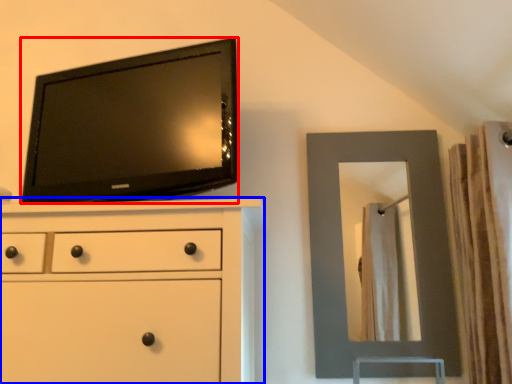
Question: Which object is further to the camera taking this photo, television (highlighted by a red box) or chest of drawers (highlighted by a blue box)?

Choices:
 (A) television
 (B) chest of drawers

Answer: (A)